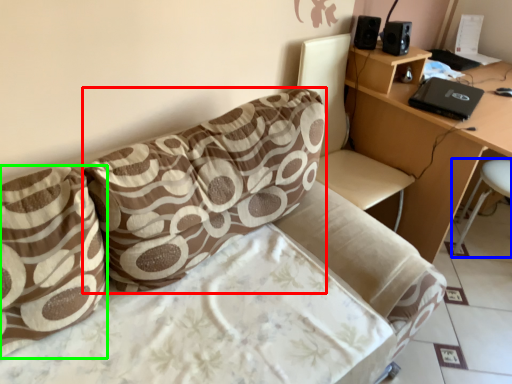
Question: Which is nearer to the pillow (highlighted by a red box)? bar stool (highlighted by a blue box) or pillow (highlighted by a green box).

Choices:
 (A) bar stool
 (B) pillow

Answer: (B)